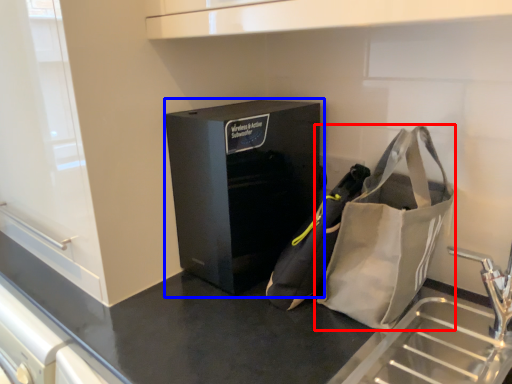
Question: Which of the following is the closest to the observer, handbag (highlighted by a red box) or furniture (highlighted by a blue box)?

Choices:
 (A) handbag
 (B) furniture

Answer: (A)